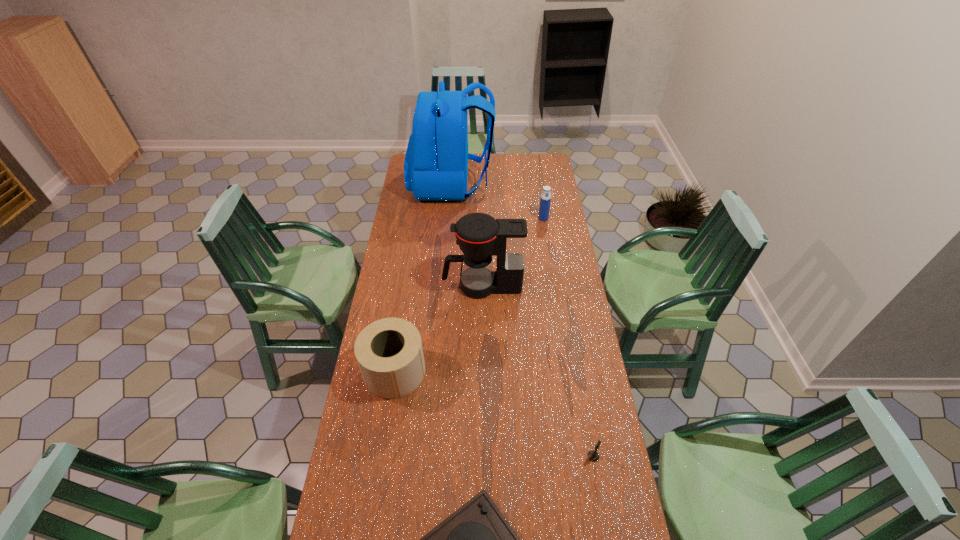
Identify the location of the farthest object. (436, 162).

Find the location of a particular element. This screenshot has height=540, width=960. backpack is located at coordinates tap(436, 162).

Identify the location of the fifth shortest object. Image resolution: width=960 pixels, height=540 pixels. point(480,236).

Locate an element on the screen. coffee maker is located at coordinates coord(480,236).

The image size is (960, 540). I want to click on the second farthest object, so click(x=545, y=200).

Image resolution: width=960 pixels, height=540 pixels. I want to click on the third nearest object, so click(x=389, y=352).

Where is `the second nearest object`? This screenshot has width=960, height=540. the second nearest object is located at coordinates (593, 456).

Find the location of a particular element. candle is located at coordinates (593, 456).

Image resolution: width=960 pixels, height=540 pixels. In order to click on vacant space situated on the back of the farthest object in this screenshot , I will do `click(526, 184)`.

Locate an element on the screen. vacant area situated 0.280m pour from the carafe of the coffee maker is located at coordinates (381, 286).